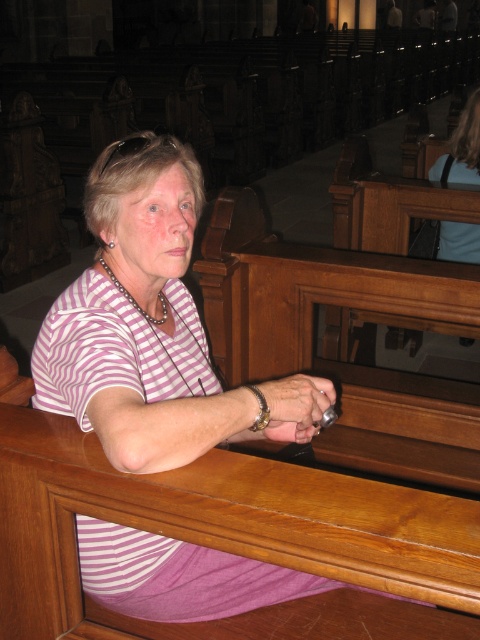
Question: Does pink striped shirt at center appear on the right side of blue fabric shirt at upper center?

Choices:
 (A) yes
 (B) no

Answer: (B)

Question: Is pink striped shirt at center positioned behind blue fabric shirt at upper center?

Choices:
 (A) no
 (B) yes

Answer: (A)

Question: Does pink striped shirt at center have a smaller size compared to gold textured bracelet at center?

Choices:
 (A) no
 (B) yes

Answer: (A)

Question: Which of the following is the closest to the observer?

Choices:
 (A) (475, 131)
 (B) (97, 304)
 (C) (245, 387)

Answer: (C)

Question: Among these points, which one is nearest to the camera?

Choices:
 (A) (456, 168)
 (B) (257, 428)

Answer: (B)

Question: Among these points, which one is nearest to the camera?

Choices:
 (A) (254, 429)
 (B) (472, 122)
 (C) (116, 288)

Answer: (A)